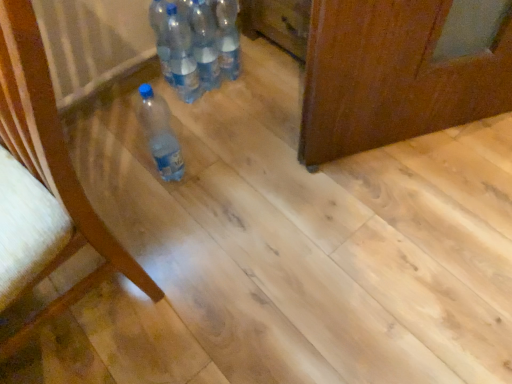
The height and width of the screenshot is (384, 512). In order to click on empty space that is to the right of translucent plastic bottle at center, marked as the 1th bottle in a top-to-bottom arrangement in this screenshot , I will do `click(272, 73)`.